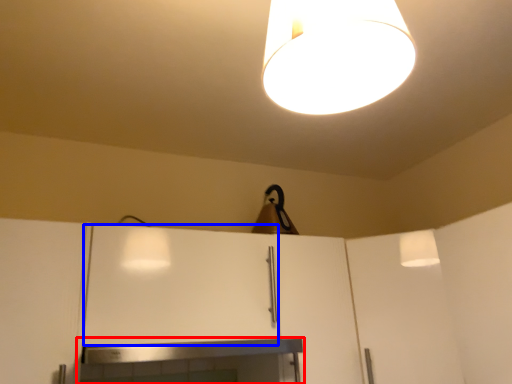
Question: Among these objects, which one is farthest to the camera, fireplace (highlighted by a red box) or cabinetry (highlighted by a blue box)?

Choices:
 (A) fireplace
 (B) cabinetry

Answer: (B)